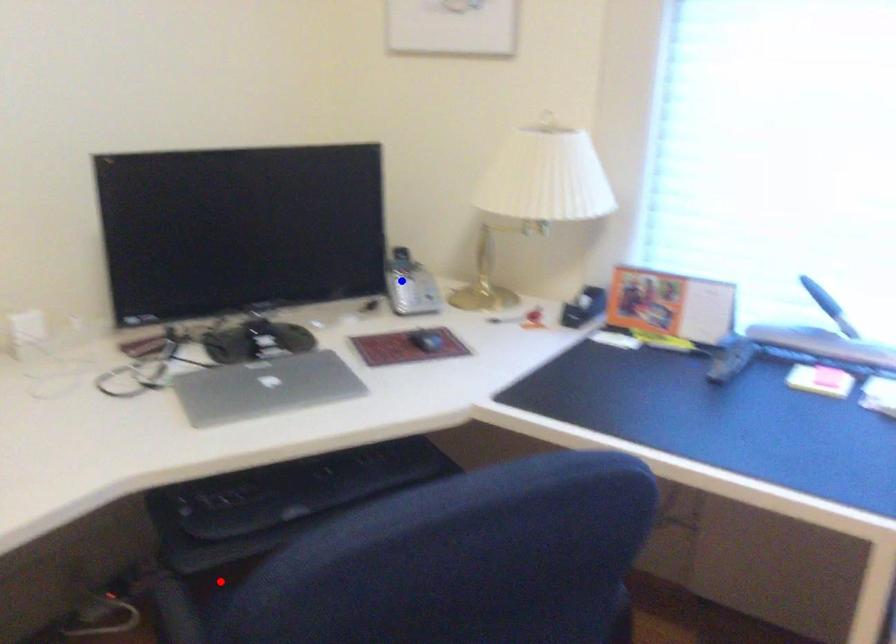
Question: In the image, two points are highlighted. Which point is nearer to the camera? Reply with the corresponding letter.

Choices:
 (A) blue point
 (B) red point

Answer: (B)